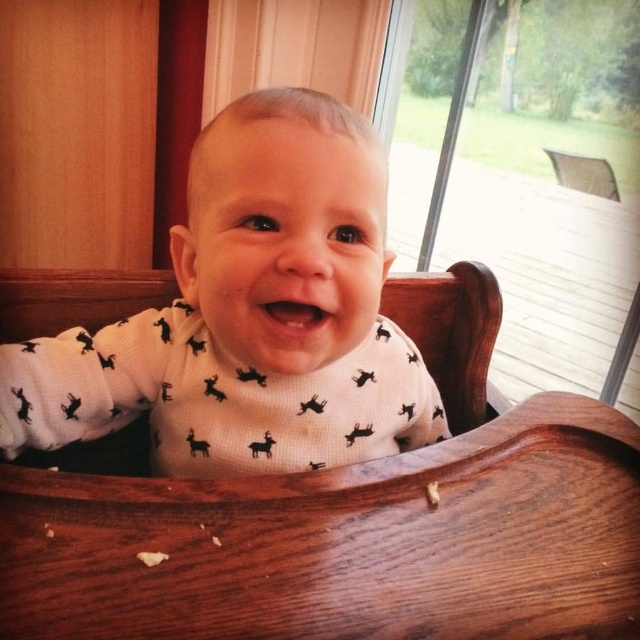
Does white matte onesie at center have a larger size compared to transparent glass screen door at upper right?

No.

Is white matte onesie at center above transparent glass screen door at upper right?

No.

Locate an element on the screen. The image size is (640, 640). white matte onesie at center is located at coordinates (250, 316).